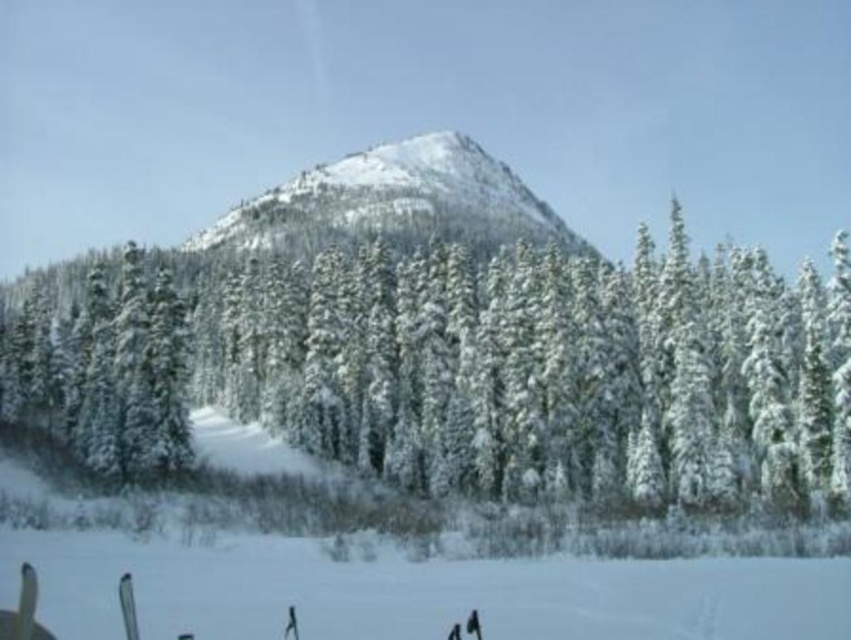
Question: Can you confirm if snow-covered evergreen at center is smaller than white snow ski slope at lower center?

Choices:
 (A) yes
 (B) no

Answer: (B)

Question: Which is farther from the snow-covered evergreen at center?

Choices:
 (A) white snow ski slope at lower center
 (B) snowy rocky peak at center

Answer: (B)

Question: Is snow-covered evergreen at center closer to camera compared to snowy rocky peak at center?

Choices:
 (A) no
 (B) yes

Answer: (B)

Question: Can you confirm if snow-covered evergreen at center is positioned to the left of white snow ski slope at lower center?

Choices:
 (A) yes
 (B) no

Answer: (A)

Question: Which point is closer to the camera taking this photo?

Choices:
 (A) (253, 273)
 (B) (220, 524)
 (C) (326, 195)

Answer: (B)

Question: Which point is closer to the camera taking this photo?

Choices:
 (A) (540, 236)
 (B) (93, 396)
 (C) (313, 604)

Answer: (C)